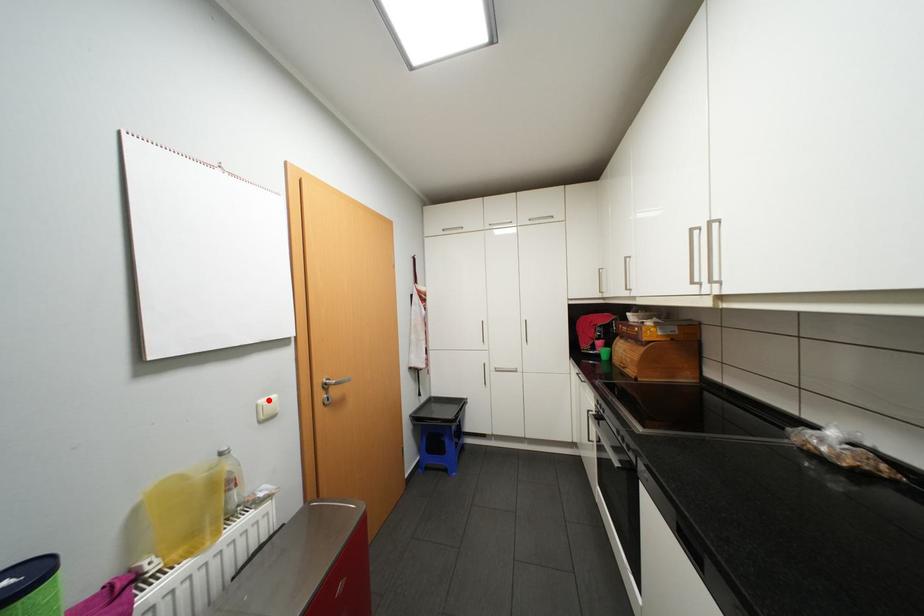
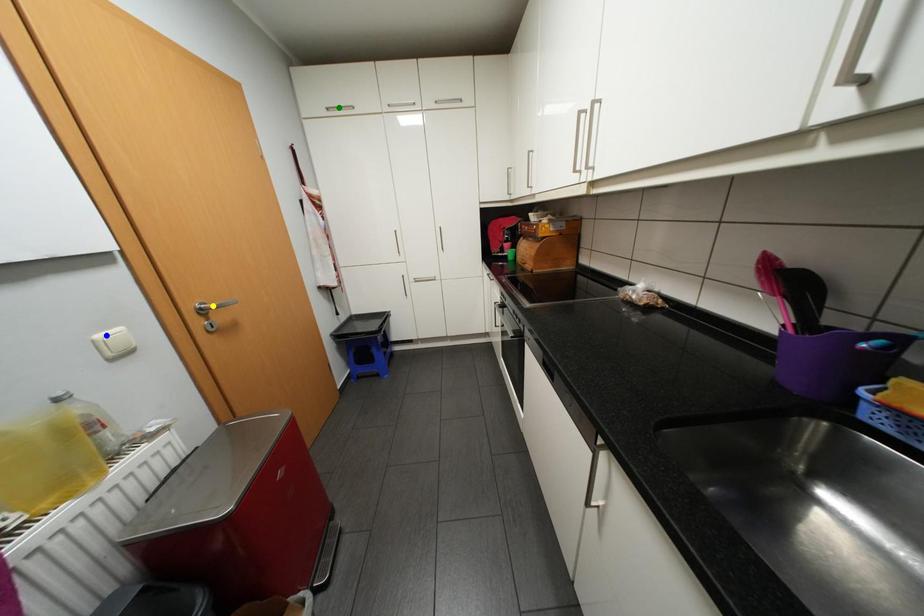
Question: I am providing you with two images of the same scene from different viewpoints. A red point is marked on the first image. You are given multiple points on the second image. Which spot in image 2 lines up with the point in image 1?

Choices:
 (A) green point
 (B) yellow point
 (C) blue point

Answer: (C)